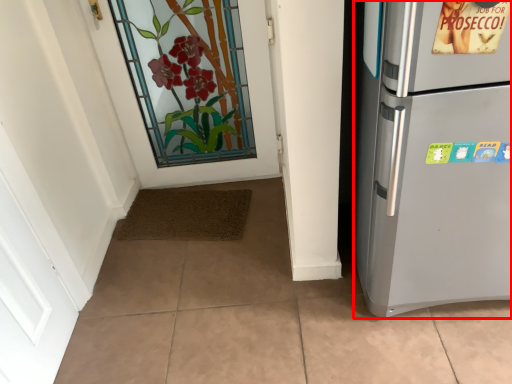
Question: From the image's perspective, where is refrigerator (annotated by the red box) located relative to door?

Choices:
 (A) below
 (B) above

Answer: (A)